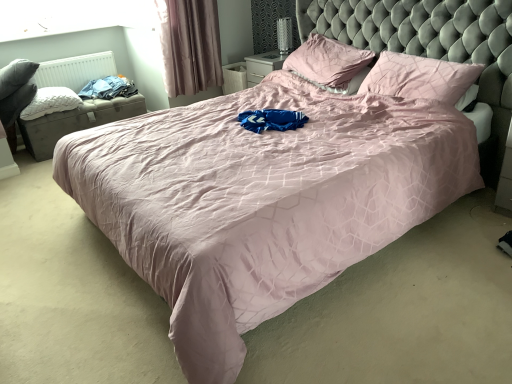
Question: Would you say mauve velvet curtain at upper left is to the left or to the right of white quilted pillow at left, arranged as the 1th pillow when viewed from the left, in the picture?

Choices:
 (A) left
 (B) right

Answer: (B)

Question: Considering the positions of mauve velvet curtain at upper left and white quilted pillow at left, arranged as the 1th pillow when viewed from the left, in the image, is mauve velvet curtain at upper left wider or thinner than white quilted pillow at left, arranged as the 1th pillow when viewed from the left,?

Choices:
 (A) thin
 (B) wide

Answer: (A)

Question: Which object is the closest to the mauve velvet curtain at upper left?

Choices:
 (A) pink satin pillow at upper center, which is the second pillow from right to left
 (B) transparent glass window screen at upper left
 (C) pink fabric pillow at upper right, which is the third pillow in left-to-right order
 (D) white matte radiator at upper left
 (E) blue cotton clothes at left

Answer: (E)

Question: Estimate the real-world distances between objects in this image. Which object is farther from the metallic silver table lamp at upper center?

Choices:
 (A) transparent glass window screen at upper left
 (B) white matte radiator at upper left
 (C) pink fabric pillow at upper right, acting as the first pillow starting from the right
 (D) pink satin pillow at upper center, which is the second pillow from right to left
 (E) white quilted pillow at left, arranged as the 1th pillow when viewed from the left

Answer: (A)